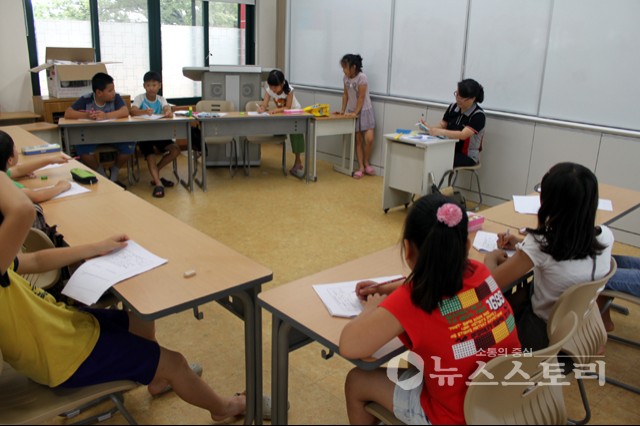
Identify the location of windows. (230, 19), (170, 24), (134, 21), (61, 22).